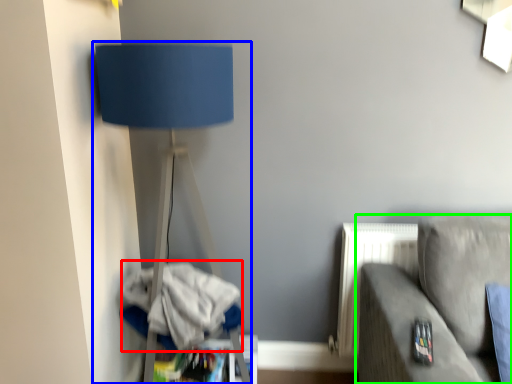
Question: Considering the real-world distances, which object is closest to laundry (highlighted by a red box)? lamp (highlighted by a blue box) or studio couch (highlighted by a green box).

Choices:
 (A) lamp
 (B) studio couch

Answer: (A)